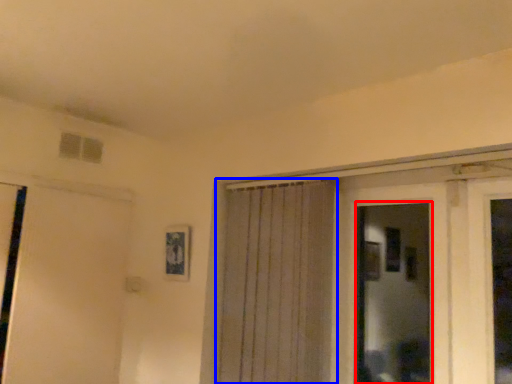
Question: Which point is further to the camera, bay window (highlighted by a red box) or curtain (highlighted by a blue box)?

Choices:
 (A) bay window
 (B) curtain

Answer: (B)